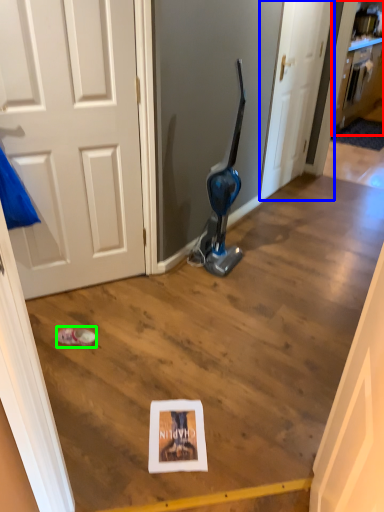
Question: Which is farther away from cabinetry (highlighted by a red box)? door (highlighted by a blue box) or footwear (highlighted by a green box)?

Choices:
 (A) door
 (B) footwear

Answer: (B)